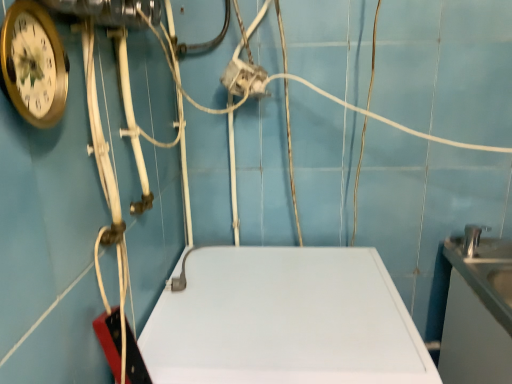
Question: Is white matte counter top at center, positioned as the first counter top in left-to-right order, taller than satin silver sink at right?

Choices:
 (A) yes
 (B) no

Answer: (A)

Question: Is satin silver sink at right located within white matte counter top at center, positioned as the first counter top in left-to-right order?

Choices:
 (A) no
 (B) yes

Answer: (A)

Question: Is white matte counter top at center, the second counter top positioned from the right, closer to the viewer compared to satin silver sink at right?

Choices:
 (A) no
 (B) yes

Answer: (B)

Question: From a real-world perspective, does white matte counter top at center, the second counter top positioned from the right, sit lower than satin silver sink at right?

Choices:
 (A) yes
 (B) no

Answer: (A)

Question: Can you see white matte counter top at center, positioned as the first counter top in left-to-right order, touching satin silver sink at right?

Choices:
 (A) no
 (B) yes

Answer: (A)

Question: Based on their positions, is white glossy counter top at right, which appears as the second counter top when viewed from the left, located to the left or right of satin silver sink at right?

Choices:
 (A) right
 (B) left

Answer: (B)

Question: From their relative heights in the image, would you say white glossy counter top at right, which appears as the second counter top when viewed from the left, is taller or shorter than satin silver sink at right?

Choices:
 (A) tall
 (B) short

Answer: (A)

Question: Is white glossy counter top at right, the 1th counter top viewed from the right, inside or outside of satin silver sink at right?

Choices:
 (A) inside
 (B) outside

Answer: (B)

Question: From the image's perspective, is white glossy counter top at right, the 1th counter top viewed from the right, positioned above or below satin silver sink at right?

Choices:
 (A) above
 (B) below

Answer: (B)

Question: From a real-world perspective, is white glossy counter top at right, which appears as the second counter top when viewed from the left, physically located above or below white matte counter top at center, the second counter top positioned from the right?

Choices:
 (A) above
 (B) below

Answer: (A)

Question: Visually, is white glossy counter top at right, which appears as the second counter top when viewed from the left, positioned to the left or to the right of white matte counter top at center, positioned as the first counter top in left-to-right order?

Choices:
 (A) left
 (B) right

Answer: (B)

Question: From the image's perspective, relative to white matte counter top at center, the second counter top positioned from the right, is white glossy counter top at right, which appears as the second counter top when viewed from the left, above or below?

Choices:
 (A) below
 (B) above

Answer: (B)

Question: Would you say white glossy counter top at right, the 1th counter top viewed from the right, is inside or outside white matte counter top at center, the second counter top positioned from the right?

Choices:
 (A) inside
 (B) outside

Answer: (B)

Question: In the image, is satin silver sink at right on the left side or the right side of white matte counter top at center, positioned as the first counter top in left-to-right order?

Choices:
 (A) right
 (B) left

Answer: (A)

Question: In the image, is satin silver sink at right positioned in front of or behind white matte counter top at center, the second counter top positioned from the right?

Choices:
 (A) front
 (B) behind

Answer: (B)